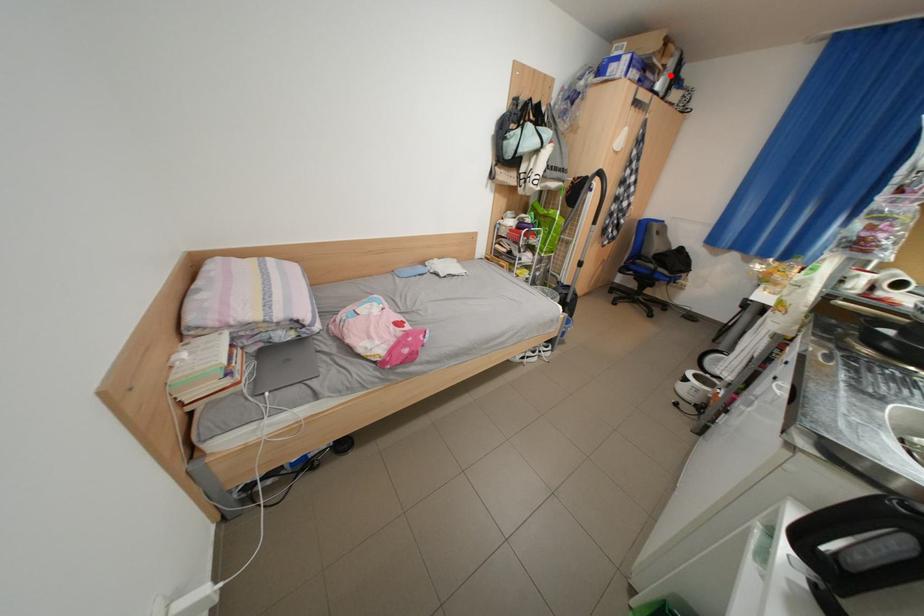
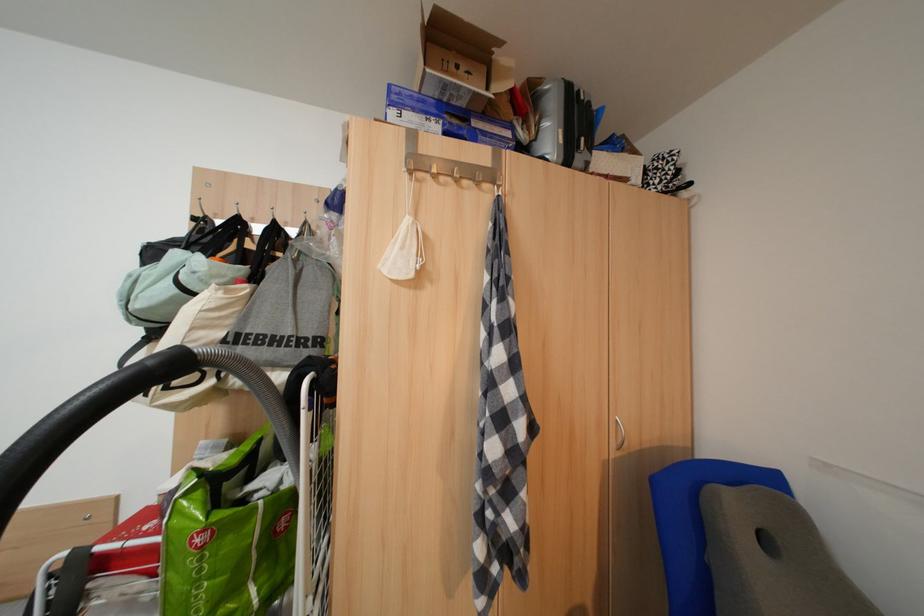
Locate, in the second image, the point that corresponds to the highlighted location in the first image.

(541, 130)